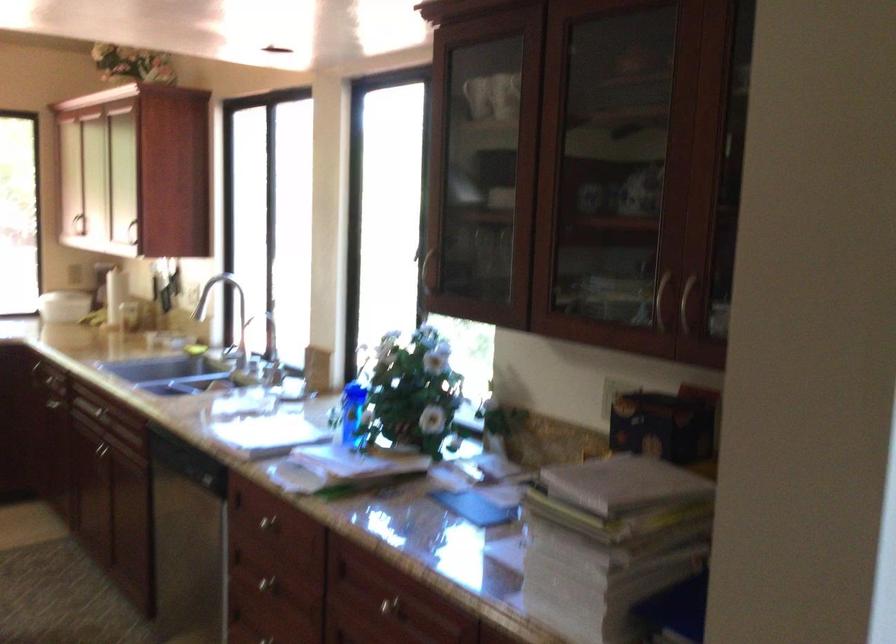
Find where to pull the faucet handle. Please return your answer as a coordinate pair (x, y).

(226, 308)